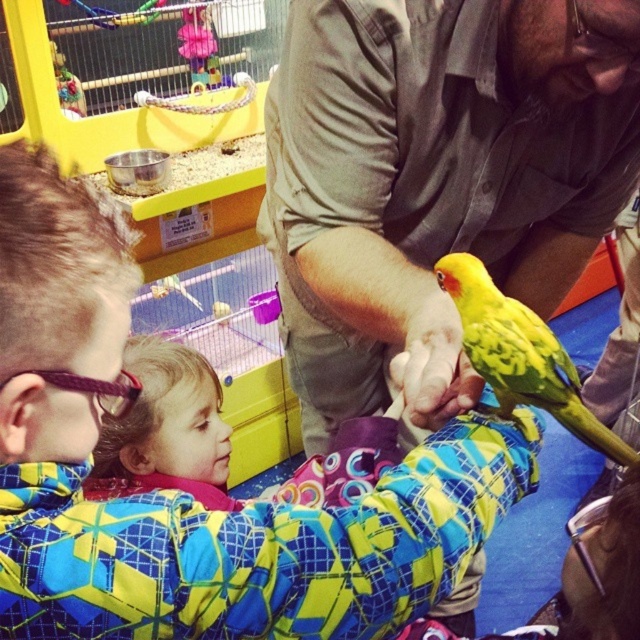
Does khaki cotton shirt at center have a greater width compared to yellow matte parrot at center?

Yes, khaki cotton shirt at center is wider than yellow matte parrot at center.

Consider the image. Who is positioned more to the left, khaki cotton shirt at center or yellow matte parrot at center?

khaki cotton shirt at center

This screenshot has width=640, height=640. What do you see at coordinates (435, 179) in the screenshot?
I see `khaki cotton shirt at center` at bounding box center [435, 179].

The width and height of the screenshot is (640, 640). What are the coordinates of `khaki cotton shirt at center` in the screenshot? It's located at point(435,179).

Between khaki cotton shirt at center and plaid fleece jacket at lower left, which one is positioned higher?

khaki cotton shirt at center is above.

What do you see at coordinates (435, 179) in the screenshot? I see `khaki cotton shirt at center` at bounding box center [435, 179].

At what (x,y) coordinates should I click in order to perform the action: click on khaki cotton shirt at center. Please return your answer as a coordinate pair (x, y). The width and height of the screenshot is (640, 640). Looking at the image, I should click on (435, 179).

How distant is plaid fleece jacket at lower left from yellow matte parrot at center?

The distance of plaid fleece jacket at lower left from yellow matte parrot at center is 9.43 inches.

The image size is (640, 640). In order to click on plaid fleece jacket at lower left in this screenshot , I will do `click(186, 493)`.

The height and width of the screenshot is (640, 640). I want to click on plaid fleece jacket at lower left, so (x=186, y=493).